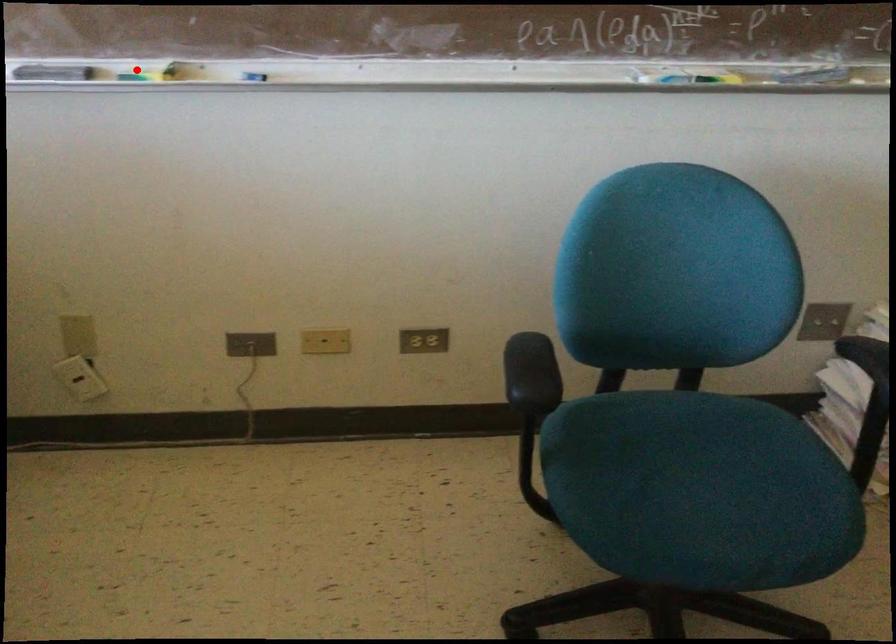
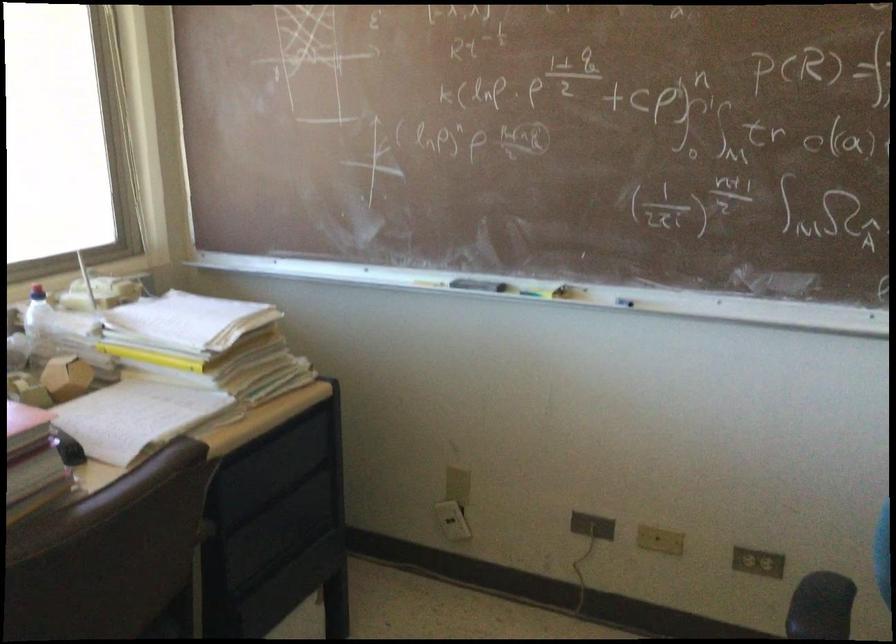
Question: A red point is marked in image1. In image2, is the corresponding 3D point closer to the camera or farther? Reply with the corresponding letter.

Choices:
 (A) The corresponding 3D point is closer.
 (B) The corresponding 3D point is farther.

Answer: (B)